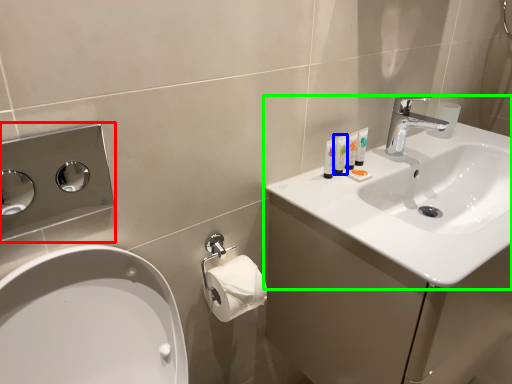
Question: Which is farther away from hand dryer (highlighted by a red box)? mouthwash (highlighted by a blue box) or sink (highlighted by a green box)?

Choices:
 (A) mouthwash
 (B) sink

Answer: (A)